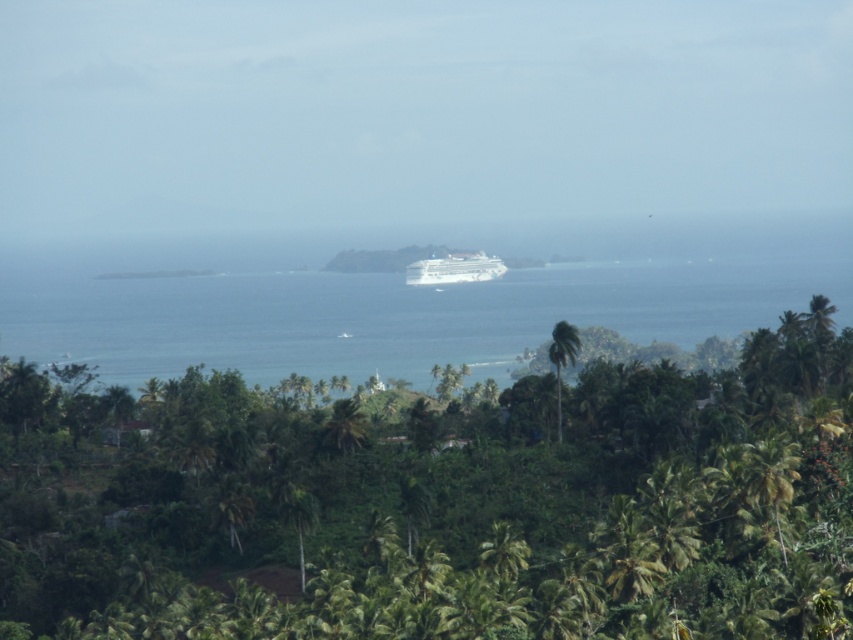
Consider the image. You are a photographer planning to capture the tropical coastal scene. You want to ensure that both the blue water at center and the white glossy cruise ship at center are visible in your shot. Based on their relative heights, which object should appear larger in your photograph?

The blue water at center has a greater height compared to the white glossy cruise ship at center, so it should appear larger in the photograph.

You are a bird flying over the tropical coastal area. You see the green leafy tree at center and the white glossy cruise ship at center. Which object is taller?

The green leafy tree at center is much taller than the white glossy cruise ship at center.